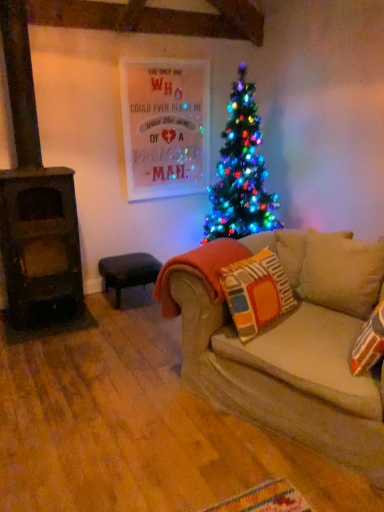
In order to face orange fleece blanket at center, should I rotate leftwards or rightwards?

Rotate right and turn 2.059 degrees.

What do you see at coordinates (199, 271) in the screenshot? The width and height of the screenshot is (384, 512). I see `orange fleece blanket at center` at bounding box center [199, 271].

Where is `orange fleece blanket at center`? orange fleece blanket at center is located at coordinates (199, 271).

I want to click on velvet dark blue stool at lower left, so click(x=128, y=272).

What do you see at coordinates (128, 272) in the screenshot?
I see `velvet dark blue stool at lower left` at bounding box center [128, 272].

Where is `orange fleece blanket at center`? The height and width of the screenshot is (512, 384). orange fleece blanket at center is located at coordinates (199, 271).

Can you confirm if orange fleece blanket at center is positioned to the right of velvet dark blue stool at lower left?

Yes, orange fleece blanket at center is to the right of velvet dark blue stool at lower left.

Between orange fleece blanket at center and velvet dark blue stool at lower left, which one is positioned behind?

Positioned behind is velvet dark blue stool at lower left.

Does point (168, 300) come closer to viewer compared to point (109, 270)?

Yes, it is.

From the image's perspective, would you say orange fleece blanket at center is positioned over velvet dark blue stool at lower left?

Yes, from the image's perspective, orange fleece blanket at center is above velvet dark blue stool at lower left.

From a real-world perspective, is orange fleece blanket at center physically below velvet dark blue stool at lower left?

No, from a real-world perspective, orange fleece blanket at center is not beneath velvet dark blue stool at lower left.

Considering the relative sizes of orange fleece blanket at center and velvet dark blue stool at lower left in the image provided, is orange fleece blanket at center wider than velvet dark blue stool at lower left?

No, orange fleece blanket at center is not wider than velvet dark blue stool at lower left.

Does orange fleece blanket at center have a lesser height compared to velvet dark blue stool at lower left?

No.

Can you confirm if orange fleece blanket at center is smaller than velvet dark blue stool at lower left?

Indeed, orange fleece blanket at center has a smaller size compared to velvet dark blue stool at lower left.

Is orange fleece blanket at center outside of velvet dark blue stool at lower left?

orange fleece blanket at center lies outside velvet dark blue stool at lower left's area.

From the picture: Does orange fleece blanket at center touch velvet dark blue stool at lower left?

orange fleece blanket at center is not next to velvet dark blue stool at lower left, and they're not touching.

Is orange fleece blanket at center facing away from velvet dark blue stool at lower left?

No, velvet dark blue stool at lower left is not at the back of orange fleece blanket at center.

Measure the distance from orange fleece blanket at center to velvet dark blue stool at lower left.

They are 39.07 inches apart.

This screenshot has height=512, width=384. What are the coordinates of `stool that appears on the left of orange fleece blanket at center` in the screenshot? It's located at (128, 272).

Which is more to the left, velvet dark blue stool at lower left or orange fleece blanket at center?

velvet dark blue stool at lower left.

Which object is further away from the camera taking this photo, velvet dark blue stool at lower left or orange fleece blanket at center?

velvet dark blue stool at lower left.

Which point is more forward, (158, 270) or (171, 302)?

The point (171, 302) is more forward.

From the image's perspective, which object appears higher, velvet dark blue stool at lower left or orange fleece blanket at center?

orange fleece blanket at center appears higher in the image.

From a real-world perspective, is velvet dark blue stool at lower left on orange fleece blanket at center?

No, from a real-world perspective, velvet dark blue stool at lower left is not on top of orange fleece blanket at center.

Is velvet dark blue stool at lower left wider or thinner than orange fleece blanket at center?

Considering their sizes, velvet dark blue stool at lower left looks broader than orange fleece blanket at center.

From their relative heights in the image, would you say velvet dark blue stool at lower left is taller or shorter than orange fleece blanket at center?

In the image, velvet dark blue stool at lower left appears to be shorter than orange fleece blanket at center.

Can you confirm if velvet dark blue stool at lower left is bigger than orange fleece blanket at center?

Indeed, velvet dark blue stool at lower left has a larger size compared to orange fleece blanket at center.

Is velvet dark blue stool at lower left not inside orange fleece blanket at center?

Indeed, velvet dark blue stool at lower left is completely outside orange fleece blanket at center.

Is velvet dark blue stool at lower left positioned far away from orange fleece blanket at center?

No, velvet dark blue stool at lower left is in close proximity to orange fleece blanket at center.

Is velvet dark blue stool at lower left facing towards orange fleece blanket at center?

Yes, velvet dark blue stool at lower left is facing orange fleece blanket at center.

This screenshot has height=512, width=384. Identify the location of stool that is behind the orange fleece blanket at center. (128, 272).

Find the location of a particular element. The width and height of the screenshot is (384, 512). blanket located on the right of velvet dark blue stool at lower left is located at coordinates (199, 271).

Locate an element on the screen. The height and width of the screenshot is (512, 384). stool that appears behind the orange fleece blanket at center is located at coordinates (128, 272).